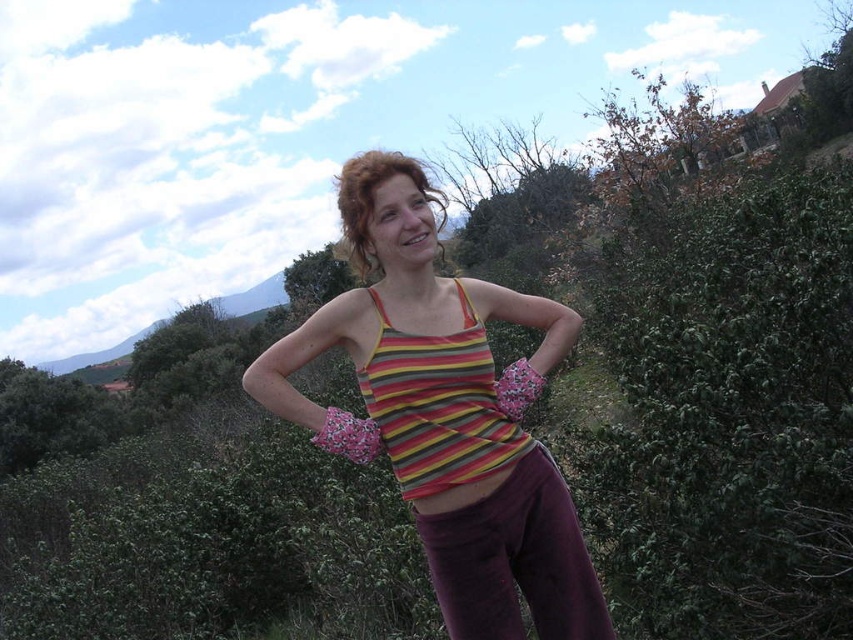
Looking at this image, you are a fashion designer analyzing the image. You need to determine the exact location of the striped fabric tank top at center in the image. What are its coordinates?

The striped fabric tank top at center is located at coordinates point (447, 412).

You are a photographer setting up a shot of the striped fabric hip at center and the green leafy hedge at right. To ensure both are in frame, should you adjust your camera to a wider angle or a narrower angle?

You should adjust your camera to a wider angle because the green leafy hedge at right is to the right of the striped fabric hip at center, meaning they are spread apart horizontally, requiring a wider angle to capture both in the frame.

You are a fashion designer observing the person in the image. You need to determine the spatial relationship between the striped fabric bikini top at center and the striped fabric hip at center. Which one is positioned to the left?

The striped fabric bikini top at center is to the left of the striped fabric hip at center.